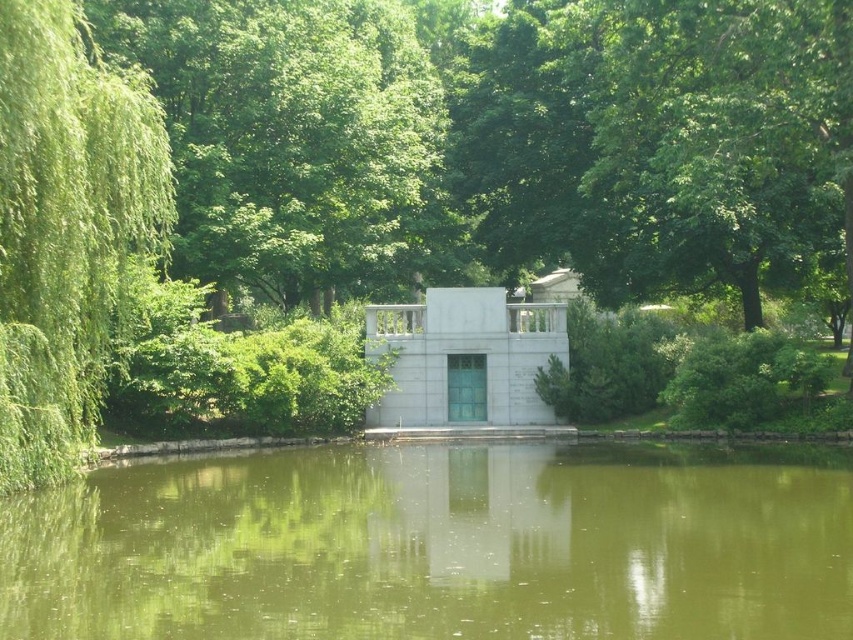
Is green leafy tree at upper left below green leafy tree at left?

No.

At what (x,y) coordinates should I click in order to perform the action: click on green leafy tree at upper left. Please return your answer as a coordinate pair (x, y). Image resolution: width=853 pixels, height=640 pixels. Looking at the image, I should click on (292, 138).

Is greenish murky water at center thinner than green leafy tree at left?

Incorrect, greenish murky water at center's width is not less than green leafy tree at left's.

Is greenish murky water at center further to camera compared to green leafy tree at left?

No.

Image resolution: width=853 pixels, height=640 pixels. I want to click on greenish murky water at center, so click(439, 545).

Looking at this image, between greenish murky water at center and green leafy tree at upper left, which one has less height?

With less height is greenish murky water at center.

Which is in front, point (577, 532) or point (360, 179)?

Positioned in front is point (577, 532).

Does point (171, 486) lie in front of point (419, 128)?

Yes, point (171, 486) is closer to viewer.

Where is `greenish murky water at center`? The width and height of the screenshot is (853, 640). greenish murky water at center is located at coordinates (439, 545).